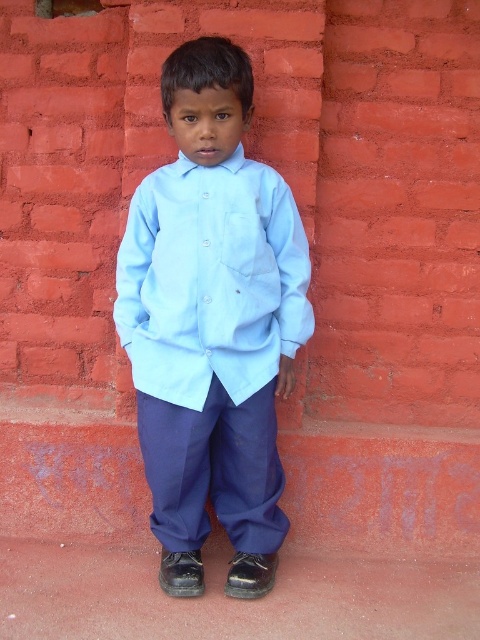
Question: Can you confirm if light blue cotton shirt at center is bigger than light blue cotton dress shirt at center?

Choices:
 (A) yes
 (B) no

Answer: (A)

Question: Which point is closer to the camera?

Choices:
 (A) navy blue cotton pants at center
 (B) light blue cotton shirt at center
 (C) light blue cotton dress shirt at center

Answer: (B)

Question: Based on their relative distances, which object is farther from the light blue cotton dress shirt at center?

Choices:
 (A) light blue cotton shirt at center
 (B) navy blue cotton pants at center

Answer: (B)

Question: Which point appears farthest from the camera in this image?

Choices:
 (A) (279, 314)
 (B) (184, 196)

Answer: (A)

Question: Is light blue cotton shirt at center closer to the viewer compared to navy blue cotton pants at center?

Choices:
 (A) no
 (B) yes

Answer: (B)

Question: Can you confirm if light blue cotton shirt at center is wider than light blue cotton dress shirt at center?

Choices:
 (A) yes
 (B) no

Answer: (B)